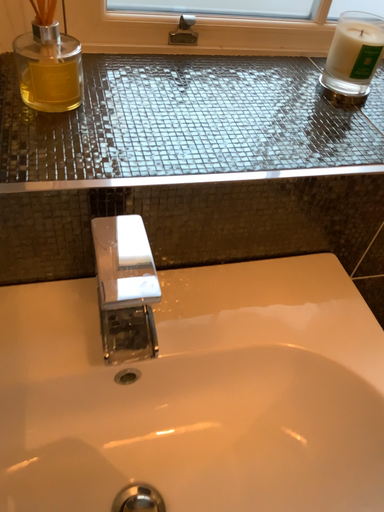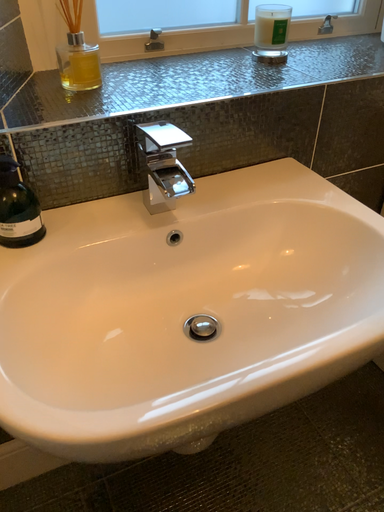
Question: How did the camera likely rotate when shooting the video?

Choices:
 (A) rotated downward
 (B) rotated upward

Answer: (B)